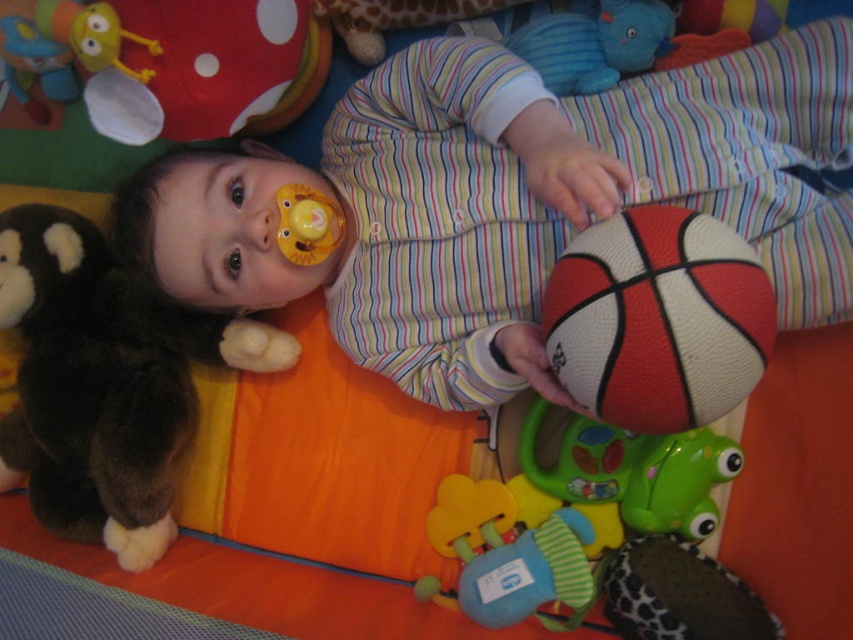
Between striped fabric baby at center and green rubber frog at lower center, which one is positioned lower?

Positioned lower is green rubber frog at lower center.

In the scene shown: Is striped fabric baby at center wider than green rubber frog at lower center?

Yes, striped fabric baby at center is wider than green rubber frog at lower center.

At what (x,y) coordinates should I click in order to perform the action: click on striped fabric baby at center. Please return your answer as a coordinate pair (x, y). The width and height of the screenshot is (853, 640). Looking at the image, I should click on (502, 200).

Find the location of a particular element. striped fabric baby at center is located at coordinates (502, 200).

Between striped fabric baby at center and brown plush monkey at left, which one appears on the left side from the viewer's perspective?

Positioned to the left is brown plush monkey at left.

How far apart are striped fabric baby at center and brown plush monkey at left?

striped fabric baby at center and brown plush monkey at left are 11.69 inches apart.

I want to click on striped fabric baby at center, so pos(502,200).

Who is positioned more to the left, brown plush monkey at left or soft plush rattle at center?

From the viewer's perspective, brown plush monkey at left appears more on the left side.

Which is above, brown plush monkey at left or soft plush rattle at center?

brown plush monkey at left

Does point (136, 324) lie behind point (544, 536)?

Yes, point (136, 324) is farther from viewer.

This screenshot has width=853, height=640. In order to click on brown plush monkey at left in this screenshot , I will do `click(103, 385)`.